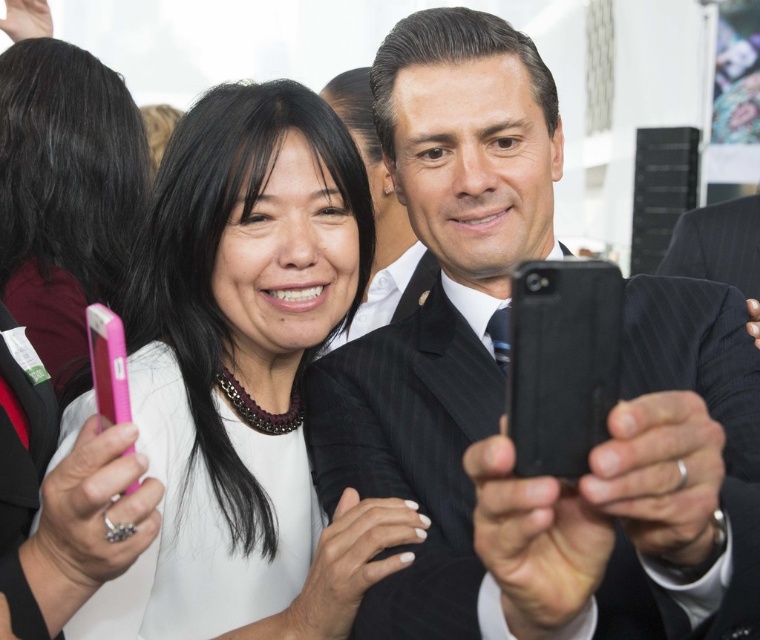
You are a photographer at the event and need to place a small LED light at the point marked as point (504, 387). According to the scene description, where exactly should you position the light?

The point (504, 387) is on the matte black suit at center, so you should position the light on the matte black suit at center.

You are organizing a photo shoot and need to ensure that the matte black suit at center and the pink plastic phone at left are both visible in the frame. Based on their sizes, which object should you prioritize positioning closer to the camera to maintain detail?

The matte black suit at center should be positioned closer to the camera because it is wider than the pink plastic phone at left, ensuring both objects remain visible and detailed in the frame.